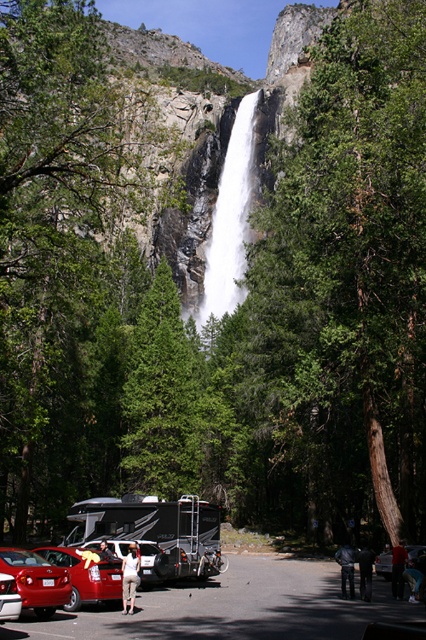
Does point (20, 560) lie behind point (131, 602)?

No, it is not.

Who is positioned more to the right, metallic red sedan at lower left or white cotton shirt at center?

Positioned to the right is white cotton shirt at center.

Is point (62, 573) positioned after point (131, 548)?

That is False.

Where is `metallic red sedan at lower left`? This screenshot has height=640, width=426. metallic red sedan at lower left is located at coordinates (37, 580).

Is silver metallic rv at center in front of white smooth waterfall at center?

Yes, it is.

Who is shorter, silver metallic rv at center or white smooth waterfall at center?

With less height is silver metallic rv at center.

From the picture: Who is more forward, (167, 544) or (238, 285)?

Point (167, 544)

The height and width of the screenshot is (640, 426). Identify the location of silver metallic rv at center. (157, 531).

From the picture: Is white smooth waterfall at center positioned behind white fabric shirt at center?

Yes, white smooth waterfall at center is further from the viewer.

Does white smooth waterfall at center have a smaller size compared to white fabric shirt at center?

No.

I want to click on white smooth waterfall at center, so click(x=230, y=220).